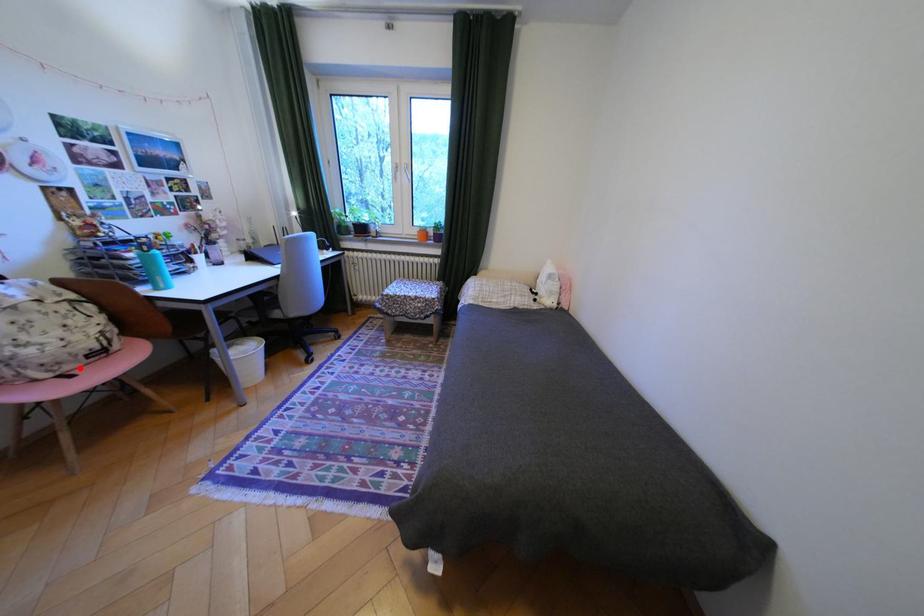
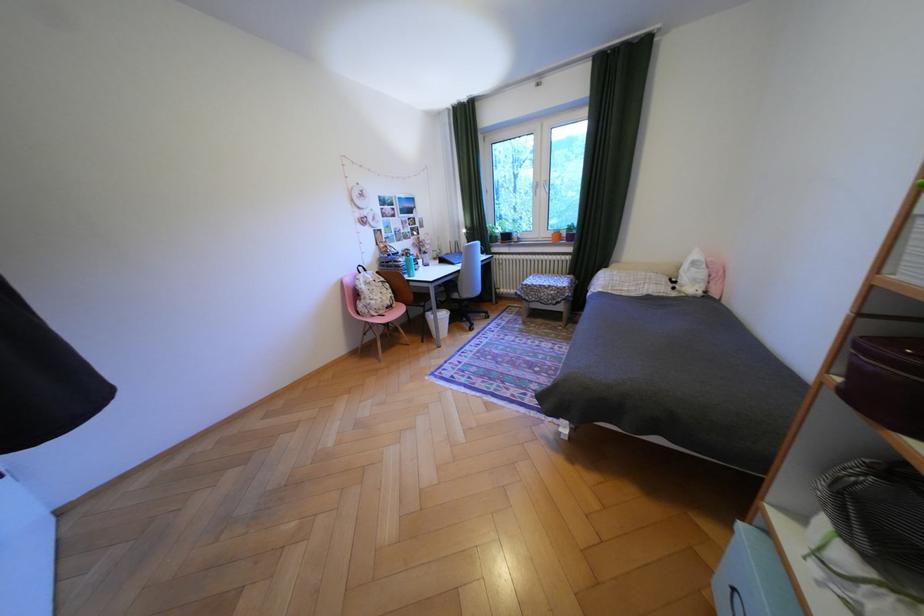
Question: I am providing you with two images of the same scene from different viewpoints. In image1, a red point is highlighted. Considering the same 3D point in image2, which of the following is correct?

Choices:
 (A) It is closer
 (B) It is farther

Answer: (A)